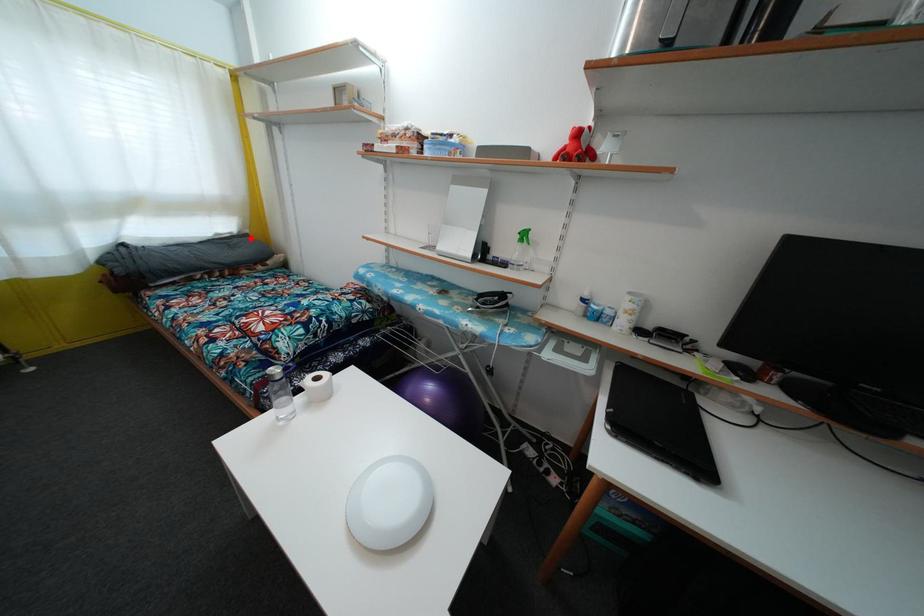
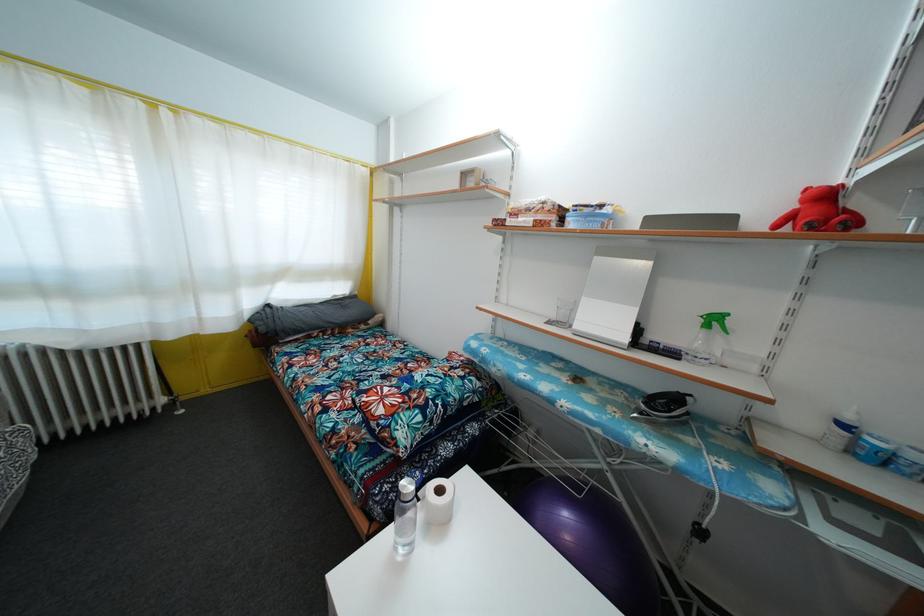
Question: A red point is marked in image1. In image2, is the corresponding 3D point closer to the camera or farther? Reply with the corresponding letter.

Choices:
 (A) The corresponding 3D point is closer.
 (B) The corresponding 3D point is farther.

Answer: (B)